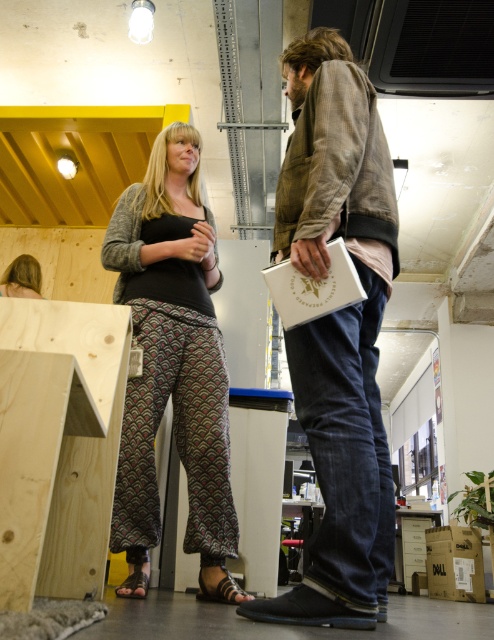
Measure the distance from patterned fabric pants at center to blonde hair at lower left.

1.19 meters

This screenshot has width=494, height=640. What do you see at coordinates (172, 365) in the screenshot?
I see `patterned fabric pants at center` at bounding box center [172, 365].

The image size is (494, 640). What do you see at coordinates (172, 365) in the screenshot?
I see `patterned fabric pants at center` at bounding box center [172, 365].

What are the coordinates of `patterned fabric pants at center` in the screenshot? It's located at (172, 365).

Can you confirm if denim jacket at center is smaller than blonde hair at lower left?

Incorrect, denim jacket at center is not smaller in size than blonde hair at lower left.

Is denim jacket at center bigger than blonde hair at lower left?

Correct, denim jacket at center is larger in size than blonde hair at lower left.

Locate an element on the screen. The height and width of the screenshot is (640, 494). denim jacket at center is located at coordinates (337, 330).

Who is shorter, denim jacket at center or patterned fabric pants at center?

patterned fabric pants at center is shorter.

Does denim jacket at center lie behind patterned fabric pants at center?

No, denim jacket at center is closer to the viewer.

Where is `denim jacket at center`? The height and width of the screenshot is (640, 494). denim jacket at center is located at coordinates (337, 330).